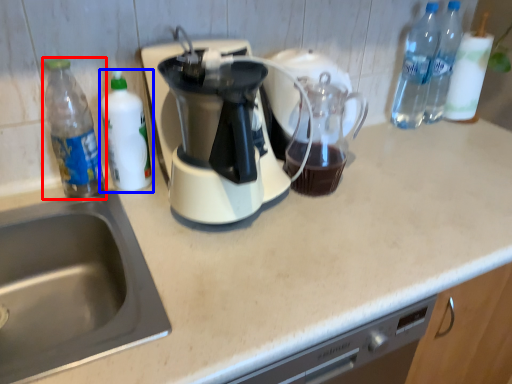
Question: Among these objects, which one is nearest to the camera, bottle (highlighted by a red box) or bottle (highlighted by a blue box)?

Choices:
 (A) bottle
 (B) bottle

Answer: (A)